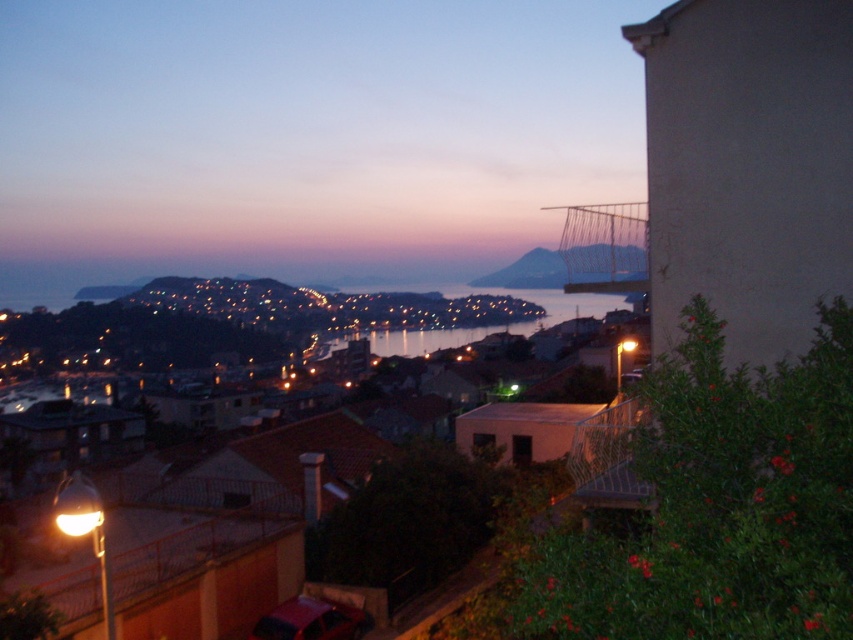
Does glistening water at center appear on the left side of matte gray hillside at center?

Correct, you'll find glistening water at center to the left of matte gray hillside at center.

Is glistening water at center closer to the viewer compared to matte gray hillside at center?

Yes, it is in front of matte gray hillside at center.

Does point (560, 307) come farther from viewer compared to point (561, 284)?

Yes, point (560, 307) is farther from viewer.

This screenshot has width=853, height=640. I want to click on glistening water at center, so click(x=488, y=323).

Can you confirm if metallic wire mesh at upper right is positioned to the right of metallic silver balcony at lower right?

Correct, you'll find metallic wire mesh at upper right to the right of metallic silver balcony at lower right.

Image resolution: width=853 pixels, height=640 pixels. I want to click on metallic wire mesh at upper right, so click(x=604, y=248).

Locate an element on the screen. metallic wire mesh at upper right is located at coordinates (604, 248).

Can you confirm if matte concrete balcony at upper right is taller than matte gray hillside at center?

Correct, matte concrete balcony at upper right is much taller as matte gray hillside at center.

Does matte concrete balcony at upper right have a greater width compared to matte gray hillside at center?

Indeed, matte concrete balcony at upper right has a greater width compared to matte gray hillside at center.

Describe the element at coordinates (305, 136) in the screenshot. I see `matte concrete balcony at upper right` at that location.

What are the coordinates of `matte concrete balcony at upper right` in the screenshot? It's located at (305, 136).